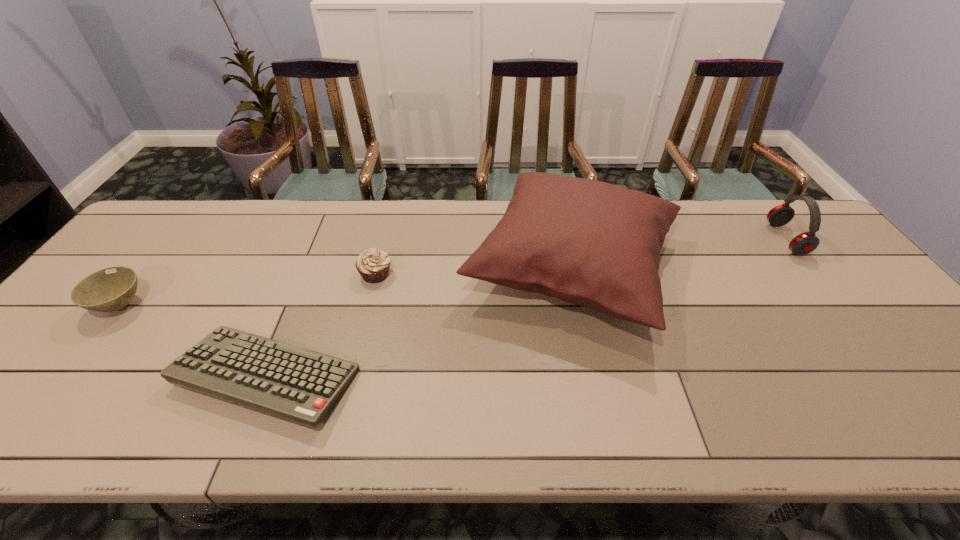
Locate an element on the screen. free space between the computer keyboard and the muffin is located at coordinates (322, 326).

This screenshot has height=540, width=960. I want to click on free point between the leftmost object and the rightmost object, so click(x=453, y=272).

I want to click on object that is the fourth closest to the rightmost object, so click(x=110, y=289).

Locate which object ranks in proximity to the fourth shortest object. Please provide its 2D coordinates. Your answer should be formatted as a tuple, i.e. [(x, y)], where the tuple contains the x and y coordinates of a point satisfying the conditions above.

[(594, 244)]

Image resolution: width=960 pixels, height=540 pixels. What are the coordinates of `vacant area that satisfies the following two spatial constraints: 1. on the back side of the muffin; 2. on the left side of the second object from right to left` in the screenshot? It's located at (377, 266).

Locate an element on the screen. The width and height of the screenshot is (960, 540). vacant space that satisfies the following two spatial constraints: 1. on the ear cups of the rightmost object; 2. on the front side of the muffin is located at coordinates (813, 274).

Where is `free space that satisfies the following two spatial constraints: 1. on the back side of the shortest object; 2. on the right side of the fourth object from left to right`? Image resolution: width=960 pixels, height=540 pixels. free space that satisfies the following two spatial constraints: 1. on the back side of the shortest object; 2. on the right side of the fourth object from left to right is located at coordinates (312, 266).